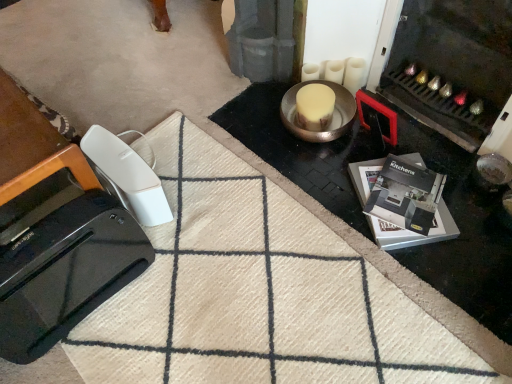
Identify the location of unoccupied space behind white plastic remote at lower left, marked as the second home appliance in a front-to-back arrangement. Image resolution: width=512 pixels, height=384 pixels. pyautogui.click(x=166, y=148).